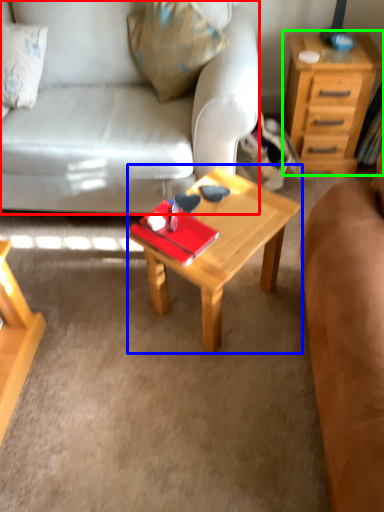
Question: Which object is the farthest from studio couch (highlighted by a red box)? Choose among these: coffee table (highlighted by a blue box) or nightstand (highlighted by a green box).

Choices:
 (A) coffee table
 (B) nightstand

Answer: (B)